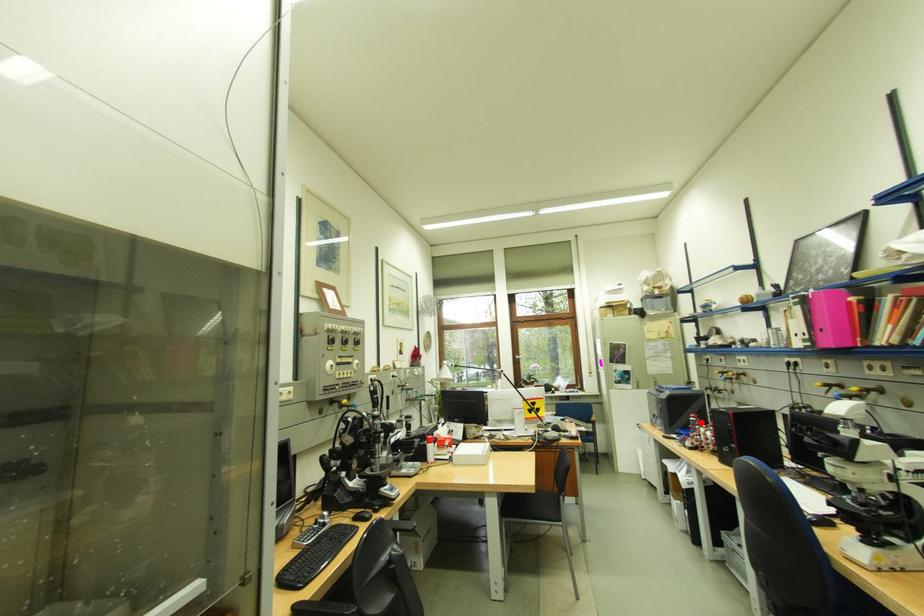
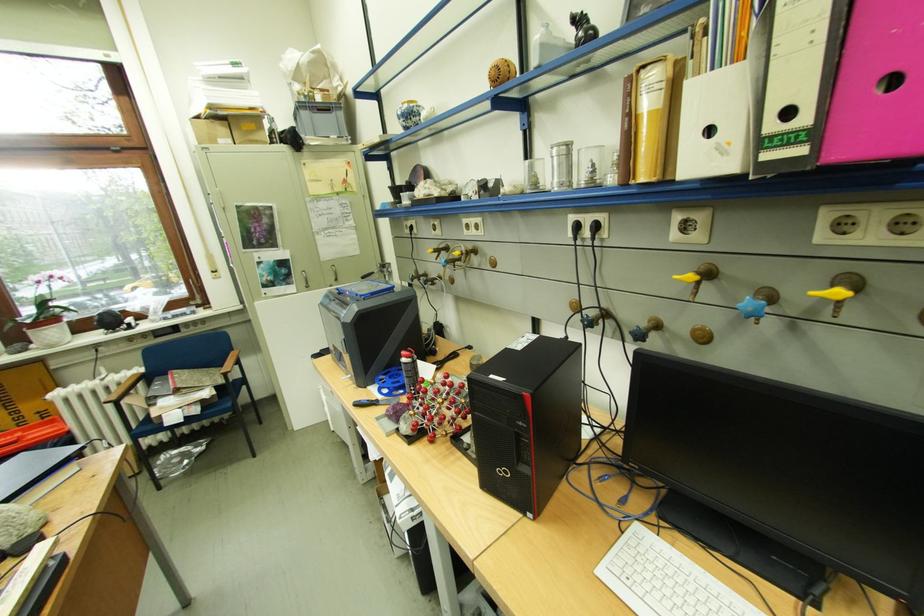
In the second image, find the point that corresponds to the highlighted location in the first image.

(412, 366)